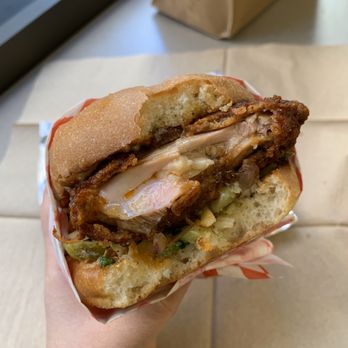
At what (x,y) coordinates should I click in order to perform the action: click on beige table top. Please return your answer as a coordinate pair (x, y). Image resolution: width=348 pixels, height=348 pixels. Looking at the image, I should click on (143, 38).